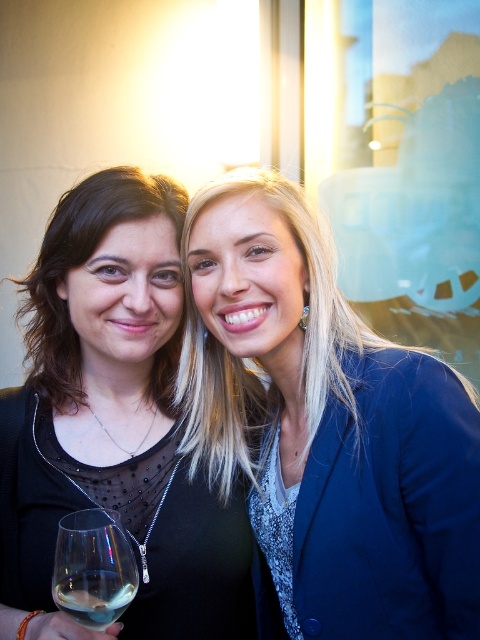
You are a photographer trying to focus on the black matte dress at center. What is the exact 2D coordinate where you should aim your camera lens to ensure the dress is centered in the frame?

The exact 2D coordinate for the black matte dress at center is at point (116,420), so you should aim your camera lens at that point to center the dress in the frame.

In the scene shown: You are a photographer setting up for a portrait. You need to place a small decorative item exactly at the point marked by the coordinates point (116, 420). According to the scene description, what object will this item be placed on?

The point (116, 420) marks the black matte dress at center, so the item will be placed on the black matte dress at center.